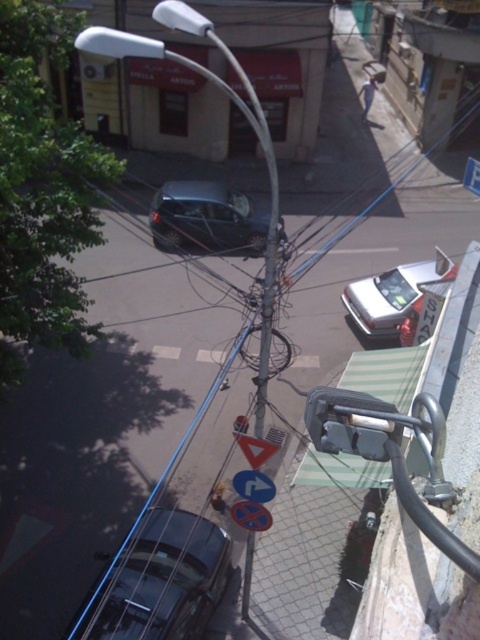
Is white glossy lamp post at center above shiny dark gray car at center?

Actually, white glossy lamp post at center is below shiny dark gray car at center.

Does white glossy lamp post at center come behind shiny dark gray car at center?

No, it is not.

Identify the location of white glossy lamp post at center. (232, 102).

The height and width of the screenshot is (640, 480). What are the coordinates of `metallic reflective arrow at center` in the screenshot? It's located at (253, 484).

Based on the photo, between metallic reflective arrow at center and red plastic triangle at center, which one has less height?

With less height is red plastic triangle at center.

Which is in front, point (251, 486) or point (275, 448)?

Point (275, 448)

Where is `metallic reflective arrow at center`? metallic reflective arrow at center is located at coordinates (253, 484).

Describe the element at coordinates (232, 102) in the screenshot. I see `white glossy lamp post at center` at that location.

Measure the distance between white glossy lamp post at center and red plastic triangle at center.

white glossy lamp post at center and red plastic triangle at center are 3.25 meters apart.

This screenshot has height=640, width=480. I want to click on white glossy lamp post at center, so click(x=232, y=102).